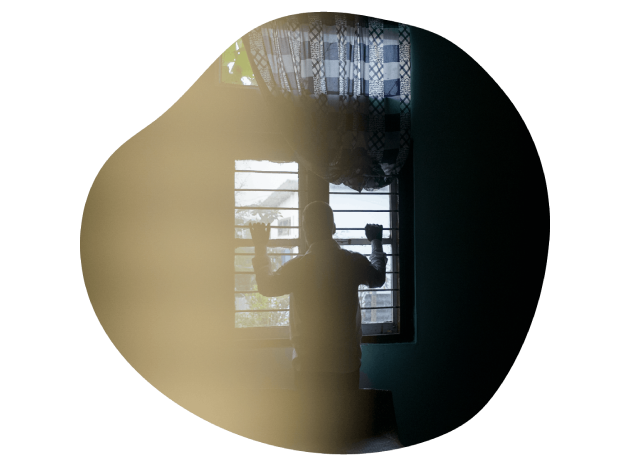
Identify the location of curtain. Image resolution: width=630 pixels, height=475 pixels. (322, 98).